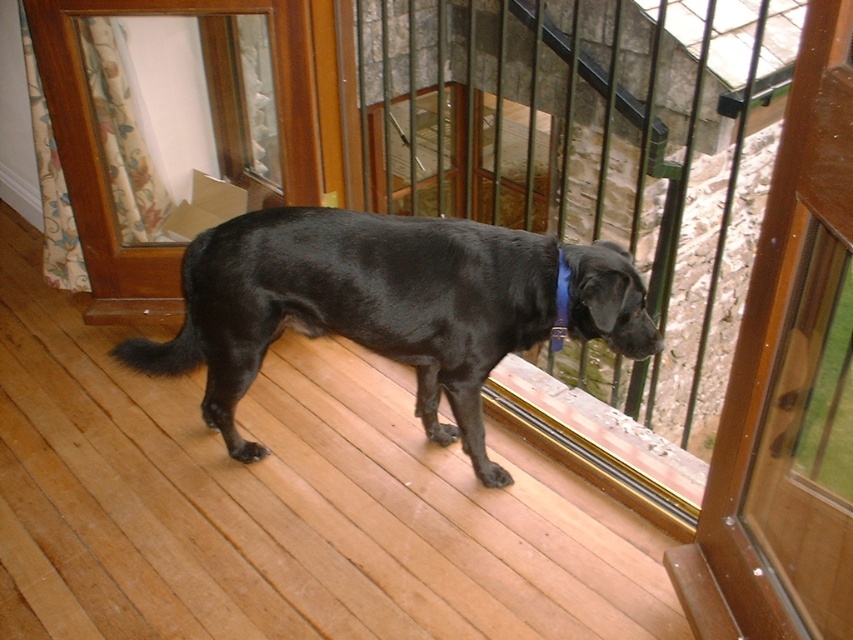
You are a delivery person who needs to pass through the transparent glass screen door at lower left while carrying a large package that is as wide as the blue fabric neckband at center. Will the package fit through the door?

The transparent glass screen door at lower left is wider than the blue fabric neckband at center, so the package will fit through the door.

You are a delivery person trying to enter the house through the transparent glass screen door at lower left. The shiny black dog at center is blocking your path. Can you walk around the dog to reach the door?

The shiny black dog at center is larger in size than the transparent glass screen door at lower left, so there might be enough space to walk around the dog to reach the door.

You are a visitor at this house and see the shiny black dog at center and the blue fabric neckband at center. Which object is located more to the left?

The shiny black dog at center is positioned on the left side of blue fabric neckband at center, so it is more to the left.